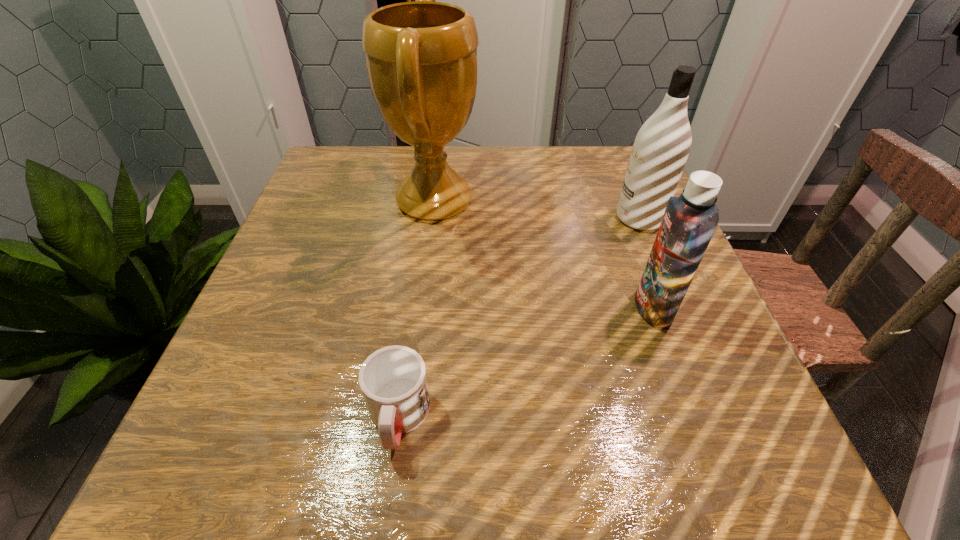
Find the location of a particular element. The height and width of the screenshot is (540, 960). vacant space located 0.350m on the front-facing side of the third shortest object is located at coordinates (458, 219).

Find the location of `vacant space located 0.090m on the front label of the shorter shampoo`. vacant space located 0.090m on the front label of the shorter shampoo is located at coordinates (586, 307).

Where is `blank area located on the front label of the shorter shampoo`? This screenshot has height=540, width=960. blank area located on the front label of the shorter shampoo is located at coordinates (591, 307).

At what (x,y) coordinates should I click in order to perform the action: click on vacant area located on the front label of the shorter shampoo. Please return your answer as a coordinate pair (x, y). The height and width of the screenshot is (540, 960). Looking at the image, I should click on (536, 307).

Where is `object that is at the far edge`? object that is at the far edge is located at coordinates (421, 57).

Identify the location of object located in the near edge section of the desktop. The width and height of the screenshot is (960, 540). (393, 380).

In the image, there is a desktop. Identify the location of free space at the far edge. (560, 158).

In the image, there is a desktop. What are the coordinates of `vacant region at the near edge` in the screenshot? It's located at (650, 474).

Identify the location of free point at the left edge. This screenshot has width=960, height=540. (317, 260).

Locate an element on the screen. blank space at the right edge of the desktop is located at coordinates (700, 413).